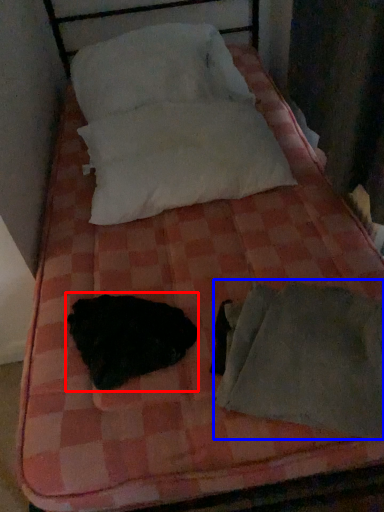
Question: Which of the following is the closest to the observer, animal (highlighted by a red box) or sleeping bag (highlighted by a blue box)?

Choices:
 (A) animal
 (B) sleeping bag

Answer: (B)